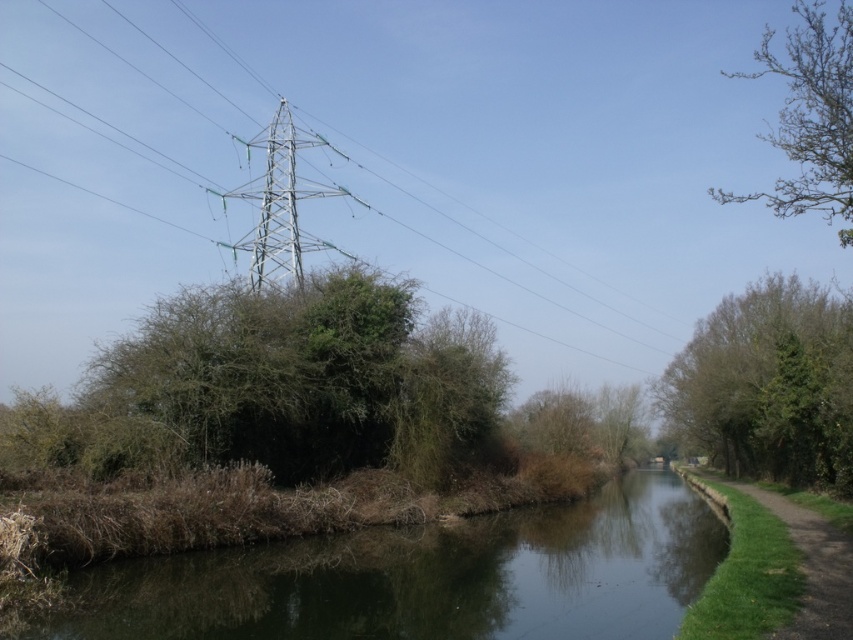
You are standing at the point marked as point (x=383, y=164) in the canal scene. Looking around, you notice the metallic silver power line at upper center. Which side of the canal is the metallic silver power line at upper center located on?

The metallic silver power line at upper center is located on the left side of the canal, as the point (x=383, y=164) is on it, and the left side has dense vegetation and an electrical pylon.

You are a bird flying over the canal scene. You want to land on the metallic silver power line at upper center or the green grassy path at lower right. Which option allows you to land more comfortably based on their sizes?

The metallic silver power line at upper center has a larger size compared to the green grassy path at lower right, so landing on the metallic silver power line at upper center would be more comfortable due to its larger surface area.

You are a bird flying over the canal scene. You see the metallic silver power line at upper center and the bare branches at upper right. Which object is located to the left of the other?

The metallic silver power line at upper center is positioned on the left side of bare branches at upper right.